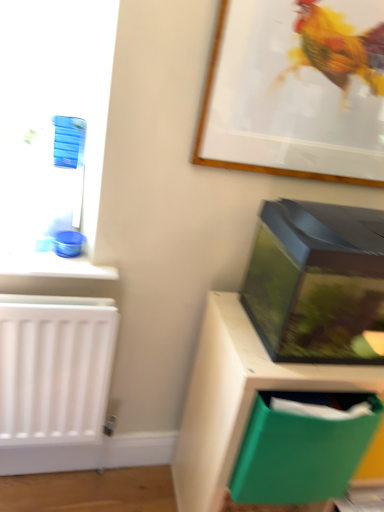
What is the approximate height of wooden picture frame at upper center?

wooden picture frame at upper center is 19.69 inches in height.

You are a GUI agent. You are given a task and a screenshot of the screen. Output one action in this format:
    pyautogui.click(x=<x>, y=<y>)
    Task: Click on the transparent plastic aquarium at right
    The image size is (384, 512).
    Given the screenshot: What is the action you would take?
    pyautogui.click(x=318, y=283)

Image resolution: width=384 pixels, height=512 pixels. In order to click on storage box on the left side of green plastic file at lower right in this screenshot , I will do `click(301, 450)`.

Is green plastic file at lower right outside of green plastic folder at lower right?

green plastic file at lower right is positioned outside green plastic folder at lower right.

Can you confirm if green plastic file at lower right is smaller than green plastic folder at lower right?

No.

Based on the photo, from the image's perspective, is green plastic file at lower right located above green plastic folder at lower right?

No.

In the scene shown: Is green plastic folder at lower right completely or partially outside of wooden picture frame at upper center?

green plastic folder at lower right is positioned outside wooden picture frame at upper center.

Is green plastic folder at lower right in front of wooden picture frame at upper center?

Yes, it is.

Considering the sizes of objects green plastic folder at lower right and wooden picture frame at upper center in the image provided, who is smaller, green plastic folder at lower right or wooden picture frame at upper center?

wooden picture frame at upper center.

Is the surface of green plastic folder at lower right in direct contact with wooden picture frame at upper center?

No, green plastic folder at lower right is not with wooden picture frame at upper center.

Measure the distance from wooden picture frame at upper center to green plastic folder at lower right.

wooden picture frame at upper center is 77.52 centimeters away from green plastic folder at lower right.

From the image's perspective, which is below, wooden picture frame at upper center or green plastic folder at lower right?

green plastic folder at lower right appears lower in the image.

Find the location of a particular element. This screenshot has width=384, height=512. storage box that is on the left side of wooden picture frame at upper center is located at coordinates (301, 450).

How many degrees apart are the facing directions of wooden picture frame at upper center and green plastic folder at lower right?

The angle between the facing direction of wooden picture frame at upper center and the facing direction of green plastic folder at lower right is 2.51 degrees.

Is transparent plastic aquarium at right wider than green plastic file at lower right?

No.

Does point (254, 276) lie in front of point (186, 462)?

Yes, point (254, 276) is in front of point (186, 462).

Which of these two, transparent plastic aquarium at right or green plastic file at lower right, stands taller?

With more height is green plastic file at lower right.

Based on their sizes in the image, would you say transparent plastic aquarium at right is bigger or smaller than green plastic file at lower right?

transparent plastic aquarium at right is smaller than green plastic file at lower right.

Is transparent plastic aquarium at right to the right of green plastic folder at lower right from the viewer's perspective?

Yes.

This screenshot has height=512, width=384. In the image, there is a transparent plastic aquarium at right. What are the coordinates of `storage box below it (from the image's perspective)` in the screenshot? It's located at (301, 450).

Would you say transparent plastic aquarium at right is a long distance from green plastic folder at lower right?

They are positioned close to each other.

Considering the relative sizes of transparent plastic aquarium at right and green plastic folder at lower right in the image provided, is transparent plastic aquarium at right thinner than green plastic folder at lower right?

In fact, transparent plastic aquarium at right might be wider than green plastic folder at lower right.

Is wooden picture frame at upper center oriented towards transparent plastic aquarium at right?

No, wooden picture frame at upper center is not aimed at transparent plastic aquarium at right.

From the image's perspective, is wooden picture frame at upper center on transparent plastic aquarium at right?

Yes.

From a real-world perspective, is wooden picture frame at upper center over transparent plastic aquarium at right?

Yes, from a real-world perspective, wooden picture frame at upper center is above transparent plastic aquarium at right.

From their relative heights in the image, would you say wooden picture frame at upper center is taller or shorter than transparent plastic aquarium at right?

Considering their sizes, wooden picture frame at upper center has more height than transparent plastic aquarium at right.

Which object is thinner, green plastic folder at lower right or transparent plastic aquarium at right?

With smaller width is green plastic folder at lower right.

From a real-world perspective, which is physically above, green plastic folder at lower right or transparent plastic aquarium at right?

transparent plastic aquarium at right is physically above.

Is green plastic folder at lower right touching transparent plastic aquarium at right?

No, green plastic folder at lower right is not touching transparent plastic aquarium at right.

Which of these two, green plastic folder at lower right or transparent plastic aquarium at right, is bigger?

transparent plastic aquarium at right.

The image size is (384, 512). I want to click on furniture that appears on the right of green plastic folder at lower right, so click(237, 398).

At what (x,y) coordinates should I click in order to perform the action: click on picture frame above the green plastic folder at lower right (from a real-world perspective). Please return your answer as a coordinate pair (x, y). The width and height of the screenshot is (384, 512). Looking at the image, I should click on (296, 90).

Based on their spatial positions, is transparent plastic aquarium at right or green plastic file at lower right further from green plastic folder at lower right?

transparent plastic aquarium at right is positioned further to the anchor green plastic folder at lower right.

From the image, which object appears to be nearer to transparent plastic aquarium at right, green plastic folder at lower right or wooden picture frame at upper center?

Among the two, green plastic folder at lower right is located nearer to transparent plastic aquarium at right.

Based on their spatial positions, is wooden picture frame at upper center or green plastic folder at lower right further from transparent plastic aquarium at right?

The object further to transparent plastic aquarium at right is wooden picture frame at upper center.

From the image, which object appears to be farther from green plastic file at lower right, transparent plastic aquarium at right or green plastic folder at lower right?

transparent plastic aquarium at right.

In the scene shown: Based on their spatial positions, is transparent plastic aquarium at right or wooden picture frame at upper center further from green plastic folder at lower right?

wooden picture frame at upper center is further to green plastic folder at lower right.

When comparing their distances from green plastic file at lower right, does transparent plastic aquarium at right or wooden picture frame at upper center seem further?

Among the two, wooden picture frame at upper center is located further to green plastic file at lower right.

Which object lies nearer to the anchor point wooden picture frame at upper center, transparent plastic aquarium at right or green plastic file at lower right?

transparent plastic aquarium at right lies closer to wooden picture frame at upper center than the other object.

When comparing their distances from wooden picture frame at upper center, does transparent plastic aquarium at right or green plastic folder at lower right seem further?

green plastic folder at lower right is positioned further to the anchor wooden picture frame at upper center.

Locate an element on the screen. The height and width of the screenshot is (512, 384). storage box that lies between wooden picture frame at upper center and green plastic file at lower right from top to bottom is located at coordinates (301, 450).

I want to click on box between wooden picture frame at upper center and green plastic folder at lower right in the vertical direction, so click(318, 283).

In order to click on storage box between transparent plastic aquarium at right and green plastic file at lower right in the vertical direction in this screenshot , I will do `click(301, 450)`.

The height and width of the screenshot is (512, 384). I want to click on box between wooden picture frame at upper center and green plastic file at lower right vertically, so pos(318,283).